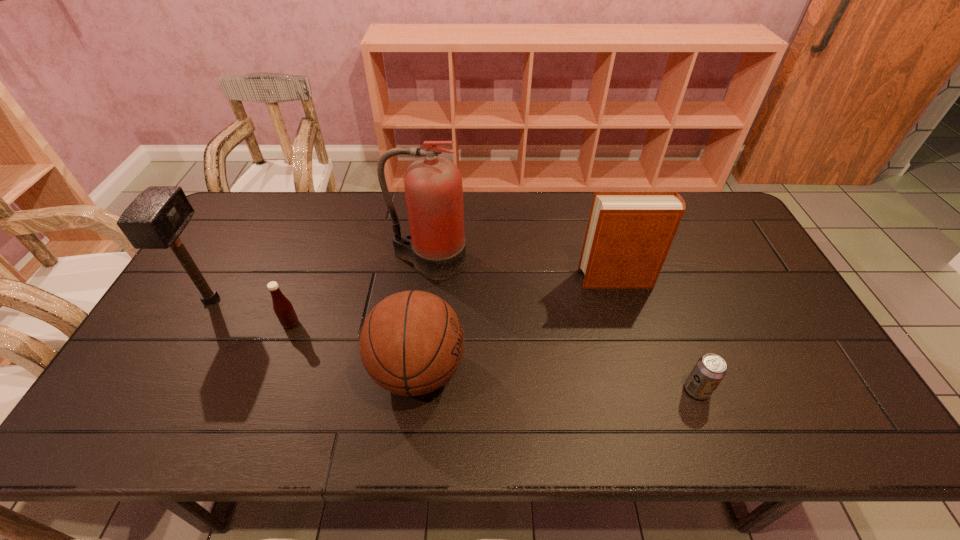
In the image, there is a desktop. Identify the location of vacant area at the right edge. (744, 262).

This screenshot has width=960, height=540. I want to click on vacant space at the far left corner of the desktop, so click(x=254, y=221).

In the image, there is a desktop. Where is `free space at the far right corner`? free space at the far right corner is located at coordinates (698, 229).

This screenshot has width=960, height=540. In order to click on empty space that is in between the basketball and the shortest object in this screenshot , I will do `click(558, 380)`.

Where is `free space between the shortest object and the basketball`? The width and height of the screenshot is (960, 540). free space between the shortest object and the basketball is located at coordinates (558, 380).

Locate an element on the screen. vacant space that's between the fifth object from right to left and the third tallest object is located at coordinates (454, 301).

I want to click on free space between the hardback book and the fourth tallest object, so click(x=517, y=325).

The image size is (960, 540). I want to click on free area in between the beer can and the Tabasco sauce, so click(493, 357).

Image resolution: width=960 pixels, height=540 pixels. I want to click on blank region between the shortest object and the basketball, so click(x=558, y=380).

The width and height of the screenshot is (960, 540). Identify the location of vacant region between the second tallest object and the third tallest object. (414, 289).